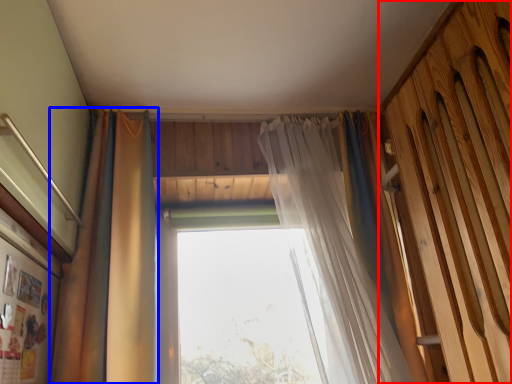
Question: Which of the following is the closest to the observer, barn door (highlighted by a red box) or curtain (highlighted by a blue box)?

Choices:
 (A) barn door
 (B) curtain

Answer: (A)